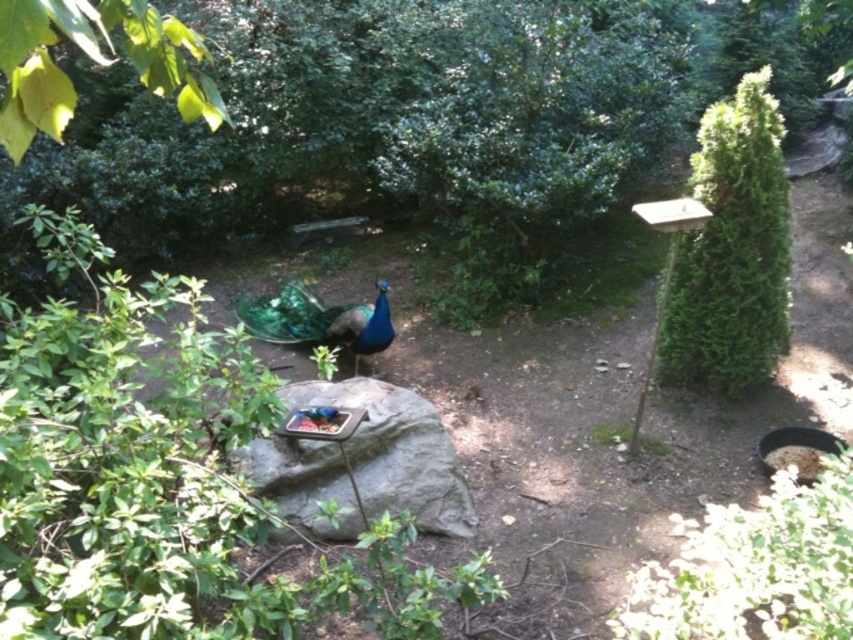
Question: Is green leafy bush at lower right to the right of gray rock at center from the viewer's perspective?

Choices:
 (A) yes
 (B) no

Answer: (A)

Question: Which object is the closest to the gray rock at center?

Choices:
 (A) green leafy bush at lower right
 (B) green leafy bush at right

Answer: (A)

Question: In this image, where is green leafy bush at right located relative to gray rock at center?

Choices:
 (A) above
 (B) below

Answer: (A)

Question: Among these objects, which one is farthest from the camera?

Choices:
 (A) green leafy bush at right
 (B) gray rock at center
 (C) green leafy bush at lower right

Answer: (A)

Question: Is green leafy bush at right wider than shiny blue-green peacock at center?

Choices:
 (A) no
 (B) yes

Answer: (A)

Question: Which of the following is the closest to the observer?

Choices:
 (A) green leafy bush at lower right
 (B) shiny blue-green peacock at center

Answer: (A)